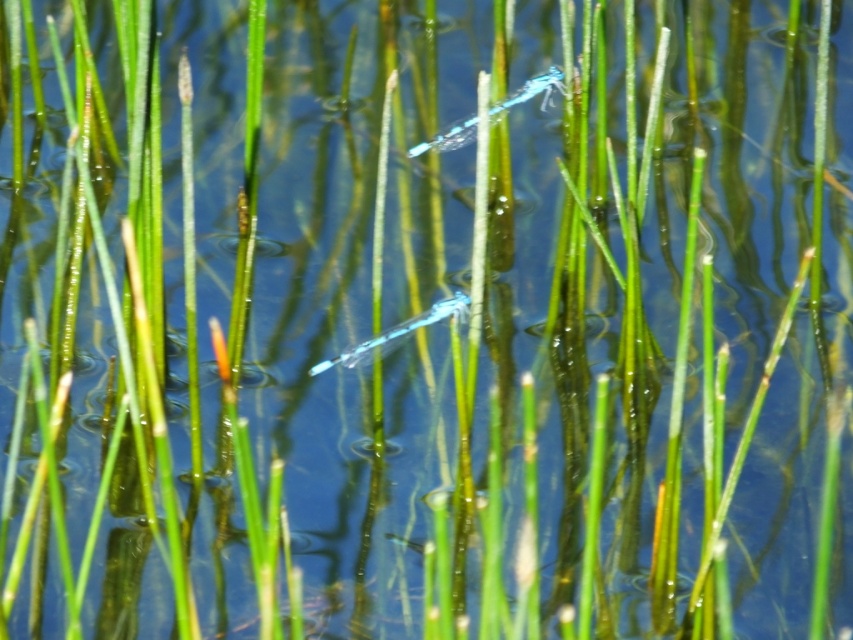
Is transparent blue dragonfly at upper center taller than translucent blue dragonfly at center?

Yes, transparent blue dragonfly at upper center is taller than translucent blue dragonfly at center.

Can you confirm if transparent blue dragonfly at upper center is positioned to the right of translucent blue dragonfly at center?

Yes, transparent blue dragonfly at upper center is to the right of translucent blue dragonfly at center.

Is point (456, 125) less distant than point (422, 310)?

Yes.

Identify the location of transparent blue dragonfly at upper center. Image resolution: width=853 pixels, height=640 pixels. (532, 92).